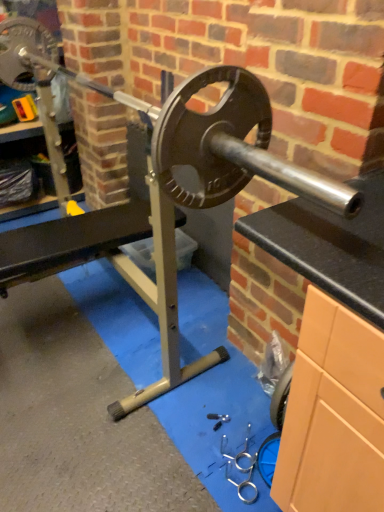
Question: Should I look upward or downward to see polished silver barbell at center?

Choices:
 (A) down
 (B) up

Answer: (B)